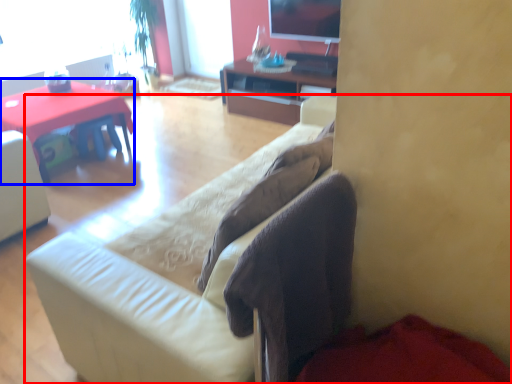
Question: Which point is further to the camera, studio couch (highlighted by a red box) or desk (highlighted by a blue box)?

Choices:
 (A) studio couch
 (B) desk

Answer: (B)